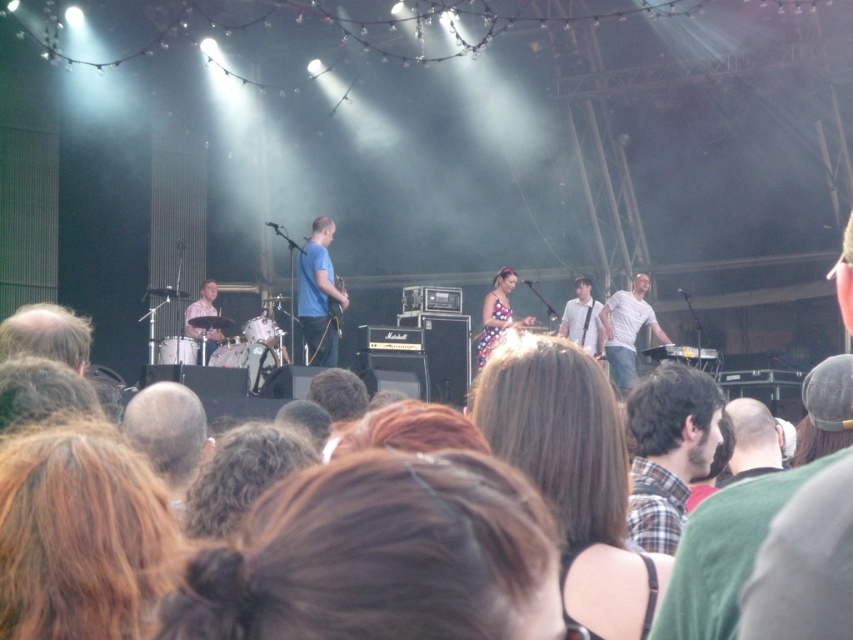
Is blue fabric shirt at center smaller than white shirt at center?

Actually, blue fabric shirt at center might be larger than white shirt at center.

Is blue fabric shirt at center wider than white shirt at center?

No, blue fabric shirt at center is not wider than white shirt at center.

Does point (321, 333) come farther from viewer compared to point (566, 308)?

No, it is in front of (566, 308).

You are a GUI agent. You are given a task and a screenshot of the screen. Output one action in this format:
    pyautogui.click(x=<x>, y=<y>)
    Task: Click on the blue fabric shirt at center
    The image size is (853, 640).
    Given the screenshot: What is the action you would take?
    pyautogui.click(x=318, y=296)

Does brown hair at center have a lesser height compared to plaid shirt at center?

No, brown hair at center is not shorter than plaid shirt at center.

Does brown hair at center have a greater height compared to plaid shirt at center?

Yes, brown hair at center is taller than plaid shirt at center.

Is point (485, 380) less distant than point (653, 468)?

Yes, point (485, 380) is in front of point (653, 468).

At what (x,y) coordinates should I click in order to perform the action: click on brown hair at center. Please return your answer as a coordinate pair (x, y). The width and height of the screenshot is (853, 640). Looking at the image, I should click on (572, 474).

Who is higher up, white cotton shirt at right or matte blue shirt at left?

matte blue shirt at left is higher up.

Describe the element at coordinates (627, 330) in the screenshot. I see `white cotton shirt at right` at that location.

Image resolution: width=853 pixels, height=640 pixels. What do you see at coordinates (627, 330) in the screenshot?
I see `white cotton shirt at right` at bounding box center [627, 330].

At what (x,y) coordinates should I click in order to perform the action: click on white cotton shirt at right. Please return your answer as a coordinate pair (x, y). The width and height of the screenshot is (853, 640). Looking at the image, I should click on (627, 330).